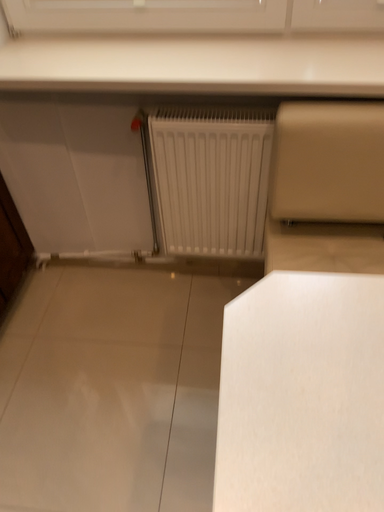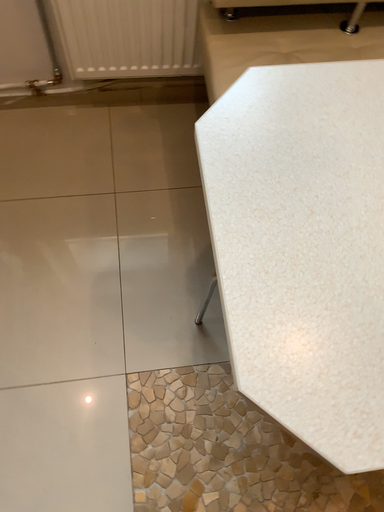
Question: Which way did the camera rotate in the video?

Choices:
 (A) rotated upward
 (B) rotated downward

Answer: (B)